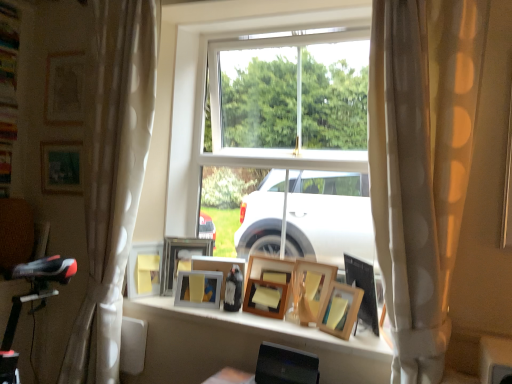
At what (x,y) coordinates should I click in order to perform the action: click on free space in front of wooden picture frame at center, the 6th picture frame positioned from the right. Please return your answer as a coordinate pair (x, y). Looking at the image, I should click on (198, 314).